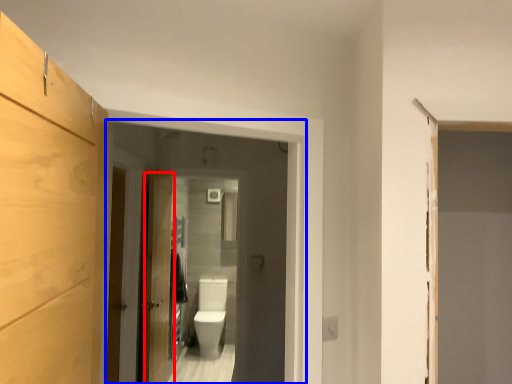
Question: Which object is closer to the camera taking this photo, door (highlighted by a red box) or screen door (highlighted by a blue box)?

Choices:
 (A) door
 (B) screen door

Answer: (B)